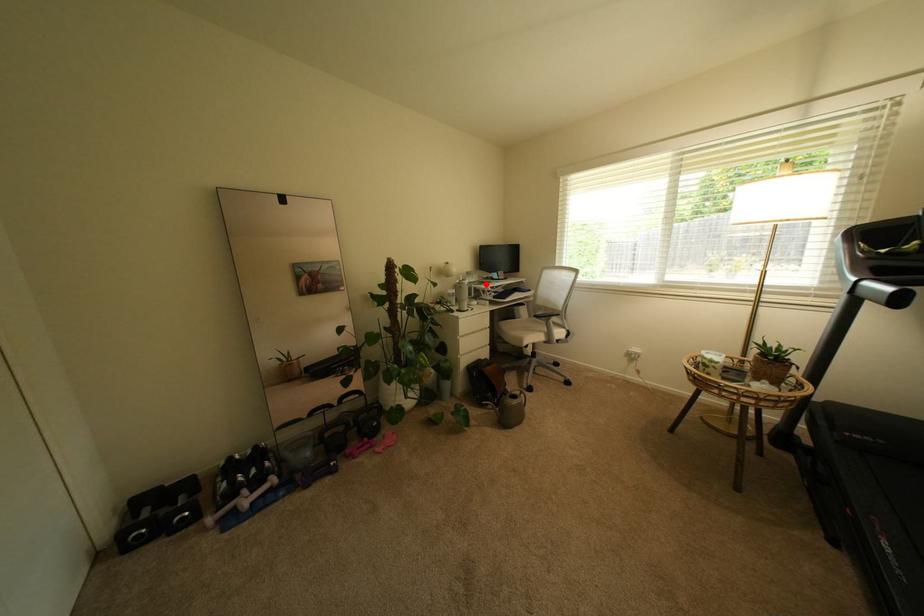
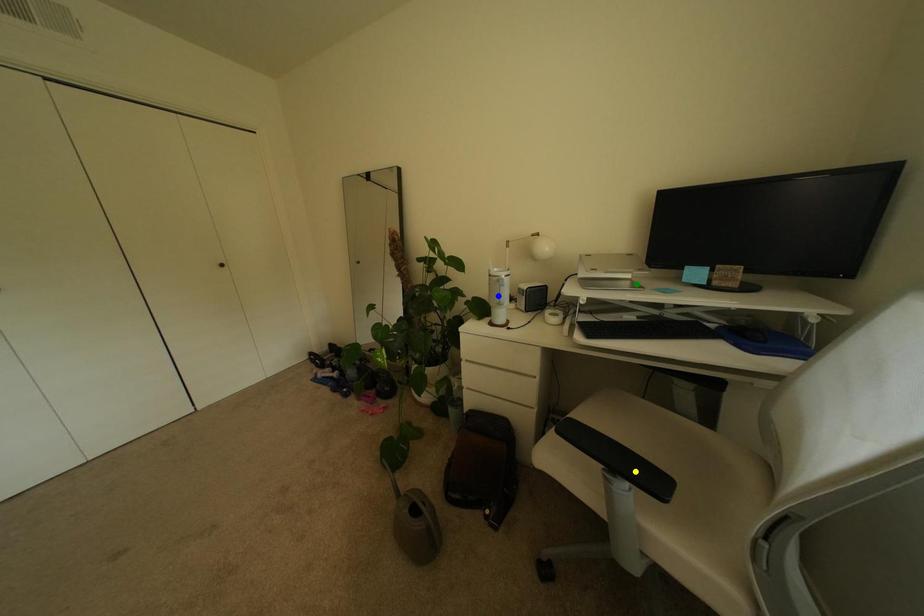
Question: I am providing you with two images of the same scene from different viewpoints. A red point is marked on the first image. You are given multiple points on the second image. Which point in image 2 represents the same 3d spot as the red point in image 1?

Choices:
 (A) yellow point
 (B) green point
 (C) blue point

Answer: (B)